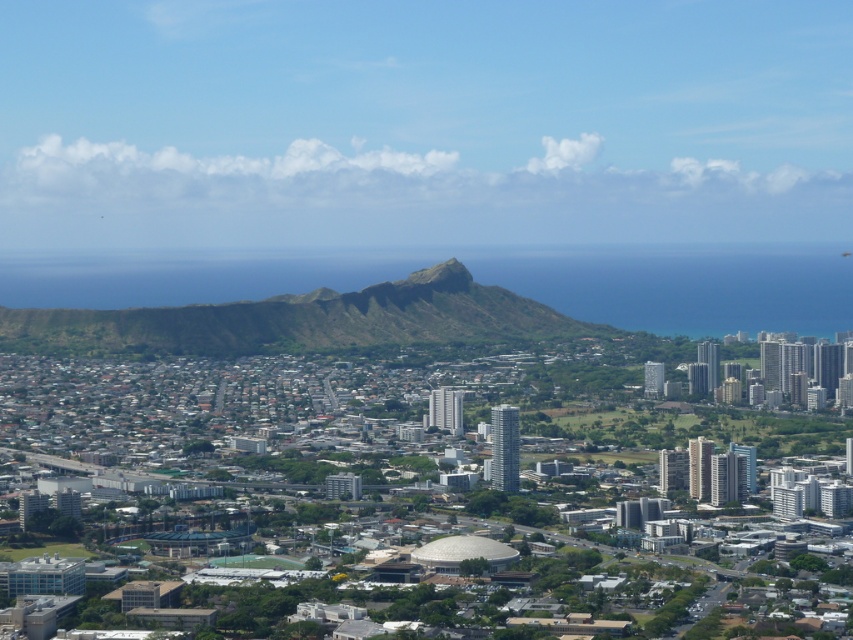
You are a drone operator who needs to fly a drone from the green grassy hill at center to the green grassy peak at center. According to the image, which direction should you fly the drone to reach the peak?

The green grassy hill at center is in front of the green grassy peak at center, so you should fly the drone backward to reach the peak.